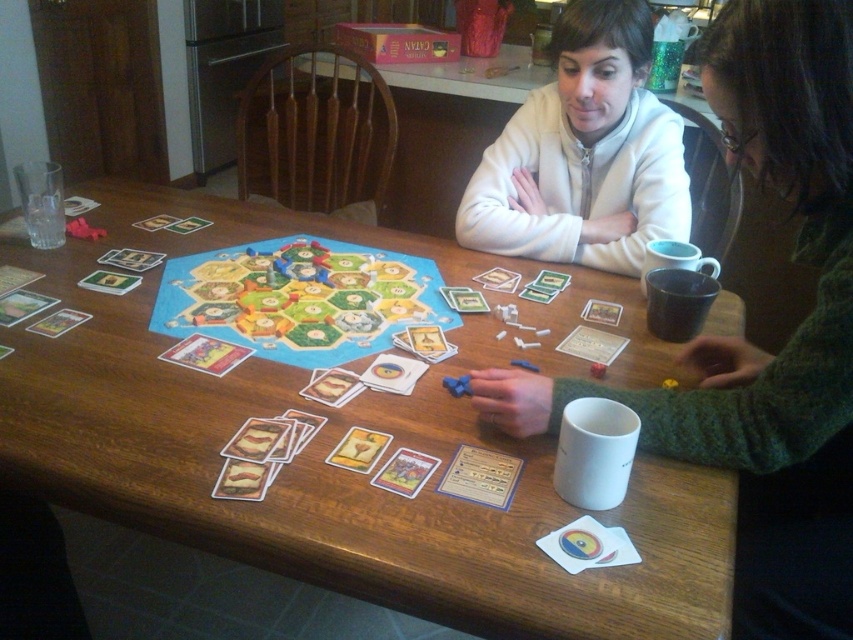
You are looking at the board game setup of Settlers of Catan. There are two points marked on the table. The first point is at coordinates [843,378] and the second is at [402,97]. Which point is closer to you?

Point [843,378] is closer to the viewer than point [402,97].

You are holding a camera and want to take a closeup photo of the point at coordinates (x=802, y=26). The camera has a focal length of 50mm and the sensor size is 36mm wide. What is the minimum distance in meters you need to move the camera closer to the point to ensure the entire sensor width captures the point without cropping?

Answer: The point at coordinates (x=802, y=26) is 27.18 inches away from the camera. To calculate the minimum distance required, use the formula distance_sensor_width_to_subject. The calculation shows that moving the camera to 0.7 meters away would ensure the sensor width captures the point without cropping.

You are standing at the origin point of the table, which is at the bottom left corner. You need to place a new game piece at point (751,344). What object is located at that coordinate?

The green textured sweater at upper right is located at point (751,344).